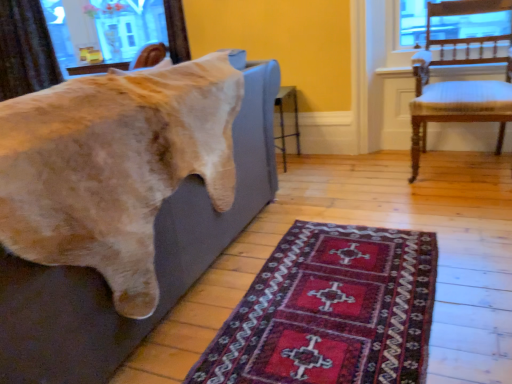
Question: Would you say soft gray couch at left is part of dark red woven rug at lower center's contents?

Choices:
 (A) no
 (B) yes

Answer: (A)

Question: Can you confirm if dark red woven rug at lower center is taller than soft gray couch at left?

Choices:
 (A) yes
 (B) no

Answer: (B)

Question: Would you say dark red woven rug at lower center is outside soft gray couch at left?

Choices:
 (A) no
 (B) yes

Answer: (B)

Question: Does dark red woven rug at lower center have a lesser height compared to soft gray couch at left?

Choices:
 (A) yes
 (B) no

Answer: (A)

Question: Is dark red woven rug at lower center at the right side of soft gray couch at left?

Choices:
 (A) yes
 (B) no

Answer: (A)

Question: From a real-world perspective, is dark red woven rug at lower center below soft gray couch at left?

Choices:
 (A) yes
 (B) no

Answer: (A)

Question: Is wooden chair with white cushioning at right taller than soft gray couch at left?

Choices:
 (A) yes
 (B) no

Answer: (A)

Question: Can you confirm if wooden chair with white cushioning at right is shorter than soft gray couch at left?

Choices:
 (A) yes
 (B) no

Answer: (B)

Question: Is wooden chair with white cushioning at right at the left side of soft gray couch at left?

Choices:
 (A) no
 (B) yes

Answer: (A)

Question: Is wooden chair with white cushioning at right bigger than soft gray couch at left?

Choices:
 (A) no
 (B) yes

Answer: (A)

Question: Could you tell me if wooden chair with white cushioning at right is turned towards soft gray couch at left?

Choices:
 (A) yes
 (B) no

Answer: (B)

Question: Can you confirm if wooden chair with white cushioning at right is positioned to the right of soft gray couch at left?

Choices:
 (A) no
 (B) yes

Answer: (B)

Question: Is soft gray couch at left located outside brown textured curtain at upper left?

Choices:
 (A) no
 (B) yes

Answer: (B)